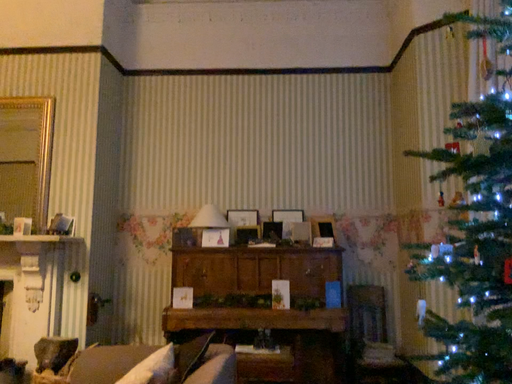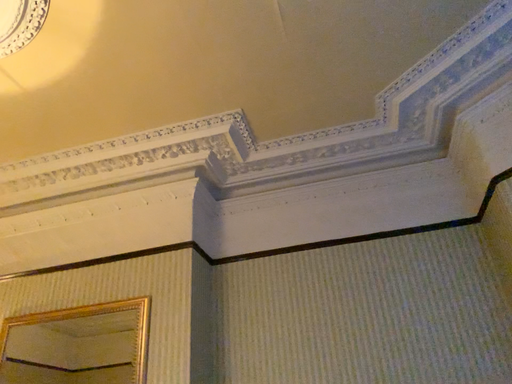
Question: How did the camera likely rotate when shooting the video?

Choices:
 (A) rotated right
 (B) rotated left

Answer: (B)